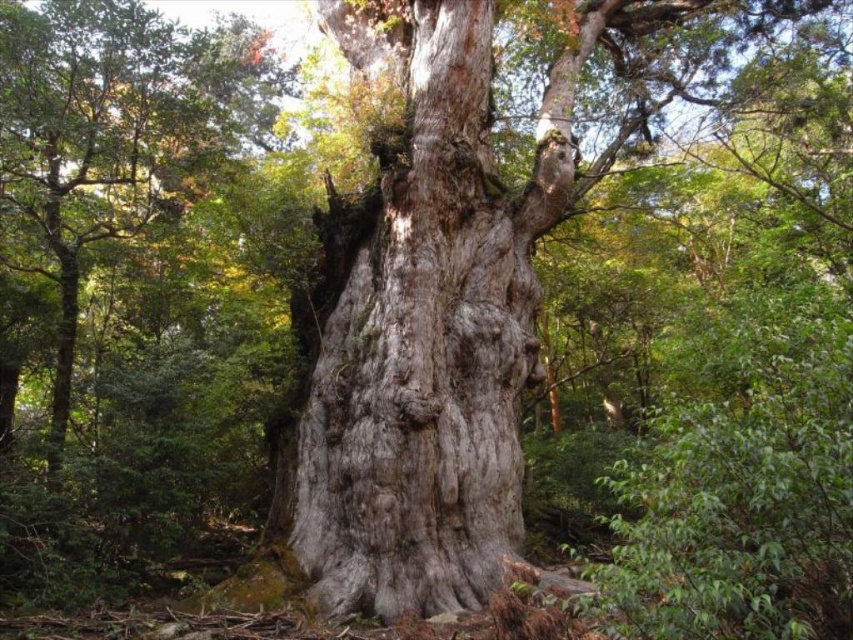
Is point (380, 589) behind point (222, 104)?

No, it is not.

Measure the distance between point (x=451, y=326) and camera.

Point (x=451, y=326) and camera are 8.16 meters apart from each other.

You are a GUI agent. You are given a task and a screenshot of the screen. Output one action in this format:
    pyautogui.click(x=<x>, y=<y>)
    Task: Click on the gray rough bark tree trunk at center
    This screenshot has width=853, height=640.
    Given the screenshot: What is the action you would take?
    pyautogui.click(x=426, y=330)